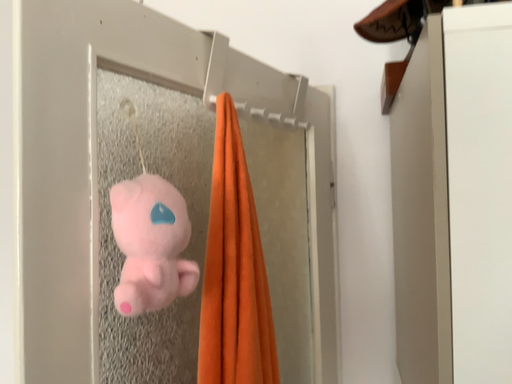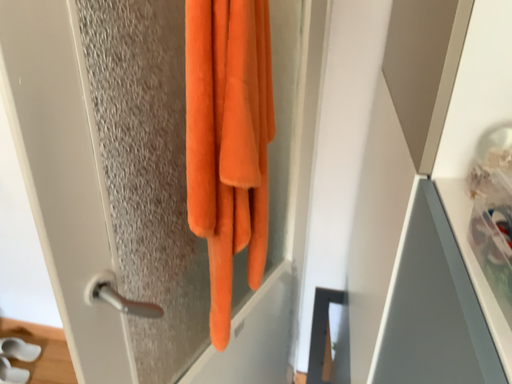
Question: Which way did the camera rotate in the video?

Choices:
 (A) rotated upward
 (B) rotated downward

Answer: (B)